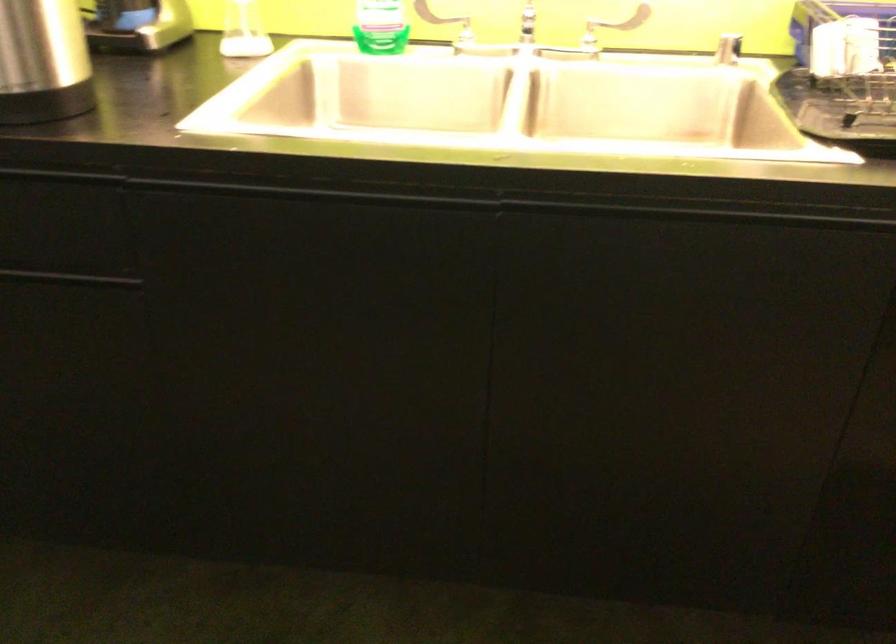
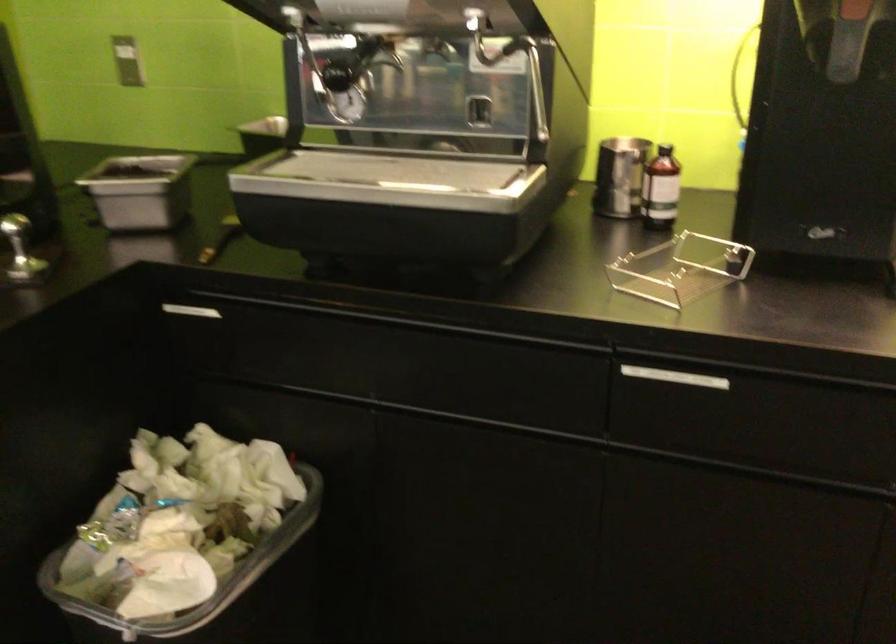
Question: In a continuous first-person perspective shot, in which direction is the camera moving?

Choices:
 (A) Left
 (B) Right
 (C) Forward
 (D) Backward

Answer: (A)